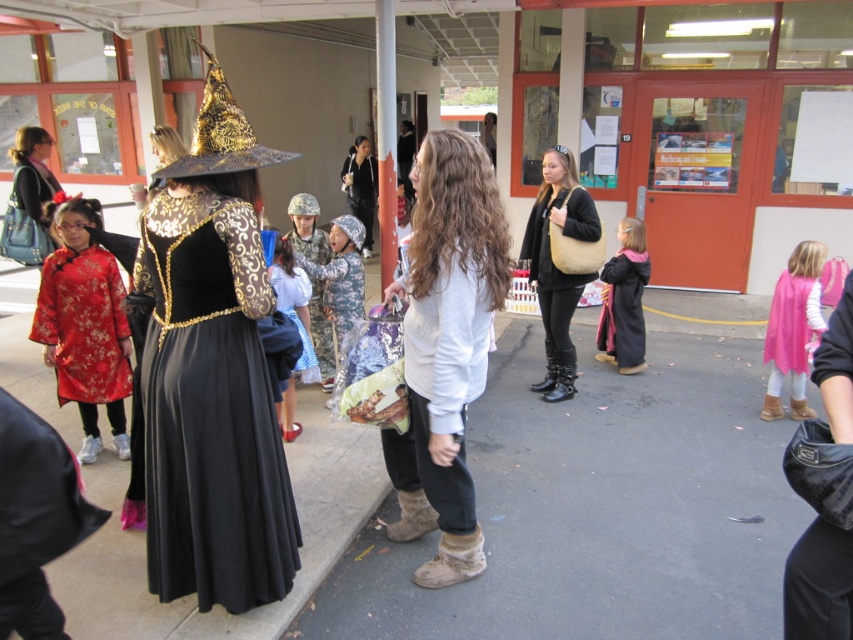
From the picture: You are organizing a costume party and need to arrange the pink satin cape at right and the black leather jacket at center. If the venue has a 10 meter long runway, can you place both items at their designated spots without overlapping?

The distance between the pink satin cape at right and the black leather jacket at center is 8.60 meters. Since the runway is 10 meters long, there is enough space to place both items without overlapping.

You are organizing a costume party and need to arrange the pink satin cape at right and the black leather jacket at center on a display rack. Which item should you place first to ensure both fit properly?

The pink satin cape at right occupies less space than the black leather jacket at center, so you should place the black leather jacket at center first to accommodate its larger size before arranging the smaller pink satin cape at right.